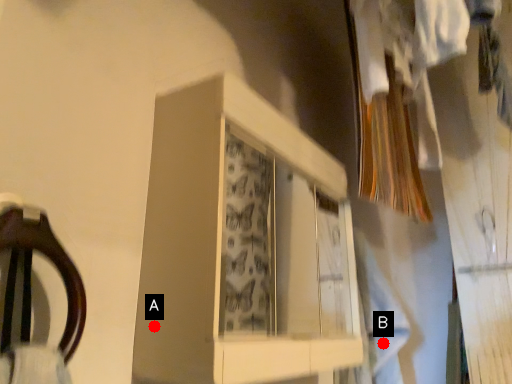
Question: Two points are circled on the image, labeled by A and B beside each circle. Which point is closer to the camera taking this photo?

Choices:
 (A) A is closer
 (B) B is closer

Answer: (A)